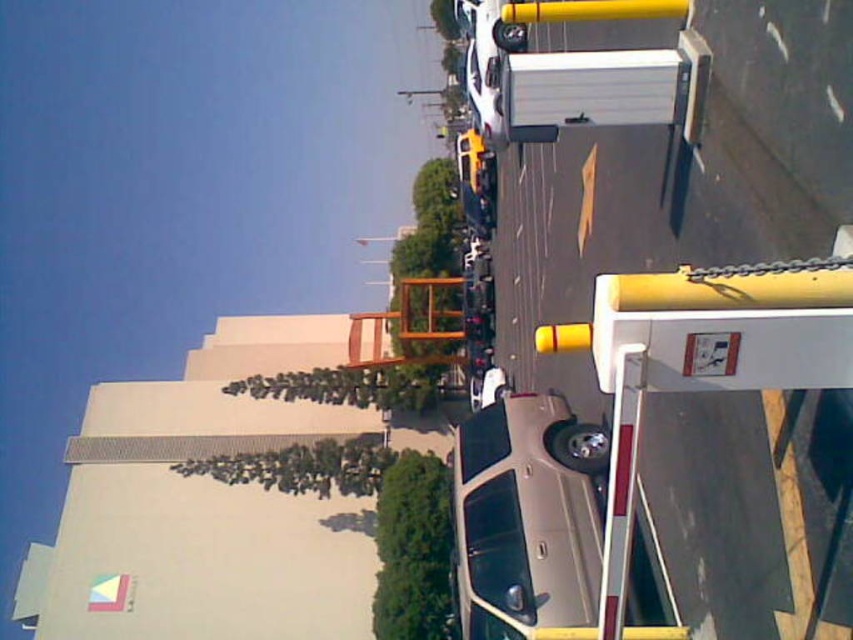
Between satin silver sedan at center and yellow matte traffic light at center, which one appears on the left side from the viewer's perspective?

Positioned to the left is satin silver sedan at center.

Which is in front, point (531, 456) or point (561, 328)?

Positioned in front is point (561, 328).

This screenshot has width=853, height=640. I want to click on satin silver sedan at center, so click(524, 520).